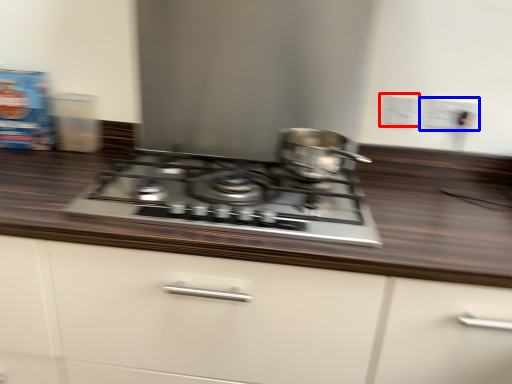
Question: Which point is closer to the camera, electric outlet (highlighted by a red box) or electric outlet (highlighted by a blue box)?

Choices:
 (A) electric outlet
 (B) electric outlet

Answer: (B)